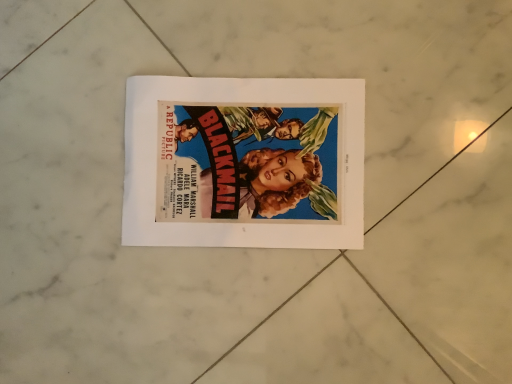
The width and height of the screenshot is (512, 384). What are the coordinates of `vacant space to the left of matte paper poster at center` in the screenshot? It's located at (78, 229).